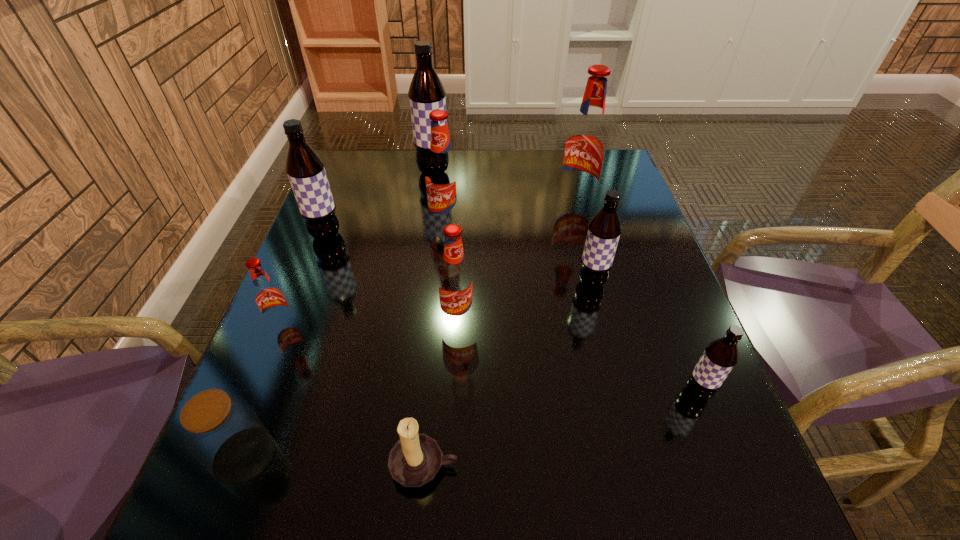
Find the location of `vacant area that lies between the candle holder and the rightmost brown root beer`. vacant area that lies between the candle holder and the rightmost brown root beer is located at coordinates (561, 429).

At what (x,y) coordinates should I click in order to perform the action: click on free point between the leftmost brown root beer and the nearest brown root beer. Please return your answer as a coordinate pair (x, y). Image resolution: width=960 pixels, height=540 pixels. Looking at the image, I should click on (512, 314).

Image resolution: width=960 pixels, height=540 pixels. I want to click on free spot between the biggest red root beer and the brown jar, so click(410, 329).

Locate an element on the screen. The image size is (960, 540). vacant space that's between the leftmost red root beer and the second biggest red root beer is located at coordinates (365, 275).

Point out which object is positioned as the fourth nearest to the smallest red root beer. Please provide its 2D coordinates. Your answer should be formatted as a tuple, i.e. [(x, y)], where the tuple contains the x and y coordinates of a point satisfying the conditions above.

[(415, 459)]

Where is `object that can be found as the fifth closest to the brown candle holder`? Image resolution: width=960 pixels, height=540 pixels. object that can be found as the fifth closest to the brown candle holder is located at coordinates (604, 230).

Locate an element on the screen. The width and height of the screenshot is (960, 540). root beer that is the closest to the rightmost brown root beer is located at coordinates (604, 230).

You are a GUI agent. You are given a task and a screenshot of the screen. Output one action in this format:
    pyautogui.click(x=<x>, y=<y>)
    Task: Click on the fourth closest root beer to the leftmost red root beer
    Image resolution: width=960 pixels, height=540 pixels.
    Given the screenshot: What is the action you would take?
    pyautogui.click(x=426, y=93)

I want to click on brown root beer that is the closest to the farthest brown root beer, so click(x=305, y=169).

Point out which brown root beer is positioned as the nearest to the nearest root beer. Please provide its 2D coordinates. Your answer should be formatted as a tuple, i.e. [(x, y)], where the tuple contains the x and y coordinates of a point satisfying the conditions above.

[(604, 230)]